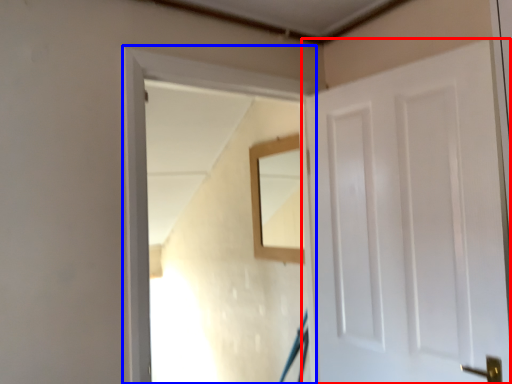
Question: Which object is closer to the camera taking this photo, door (highlighted by a red box) or window frame (highlighted by a blue box)?

Choices:
 (A) door
 (B) window frame

Answer: (A)